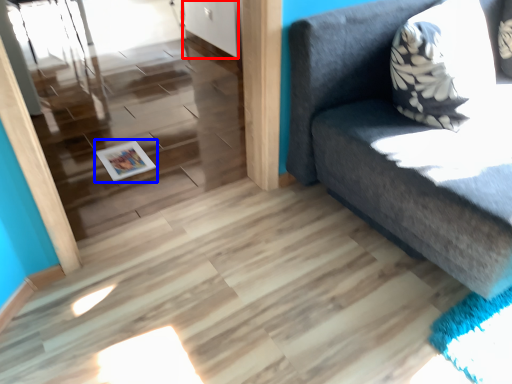
Question: Which point is further to the camera, door (highlighted by a red box) or magazine (highlighted by a blue box)?

Choices:
 (A) door
 (B) magazine

Answer: (A)